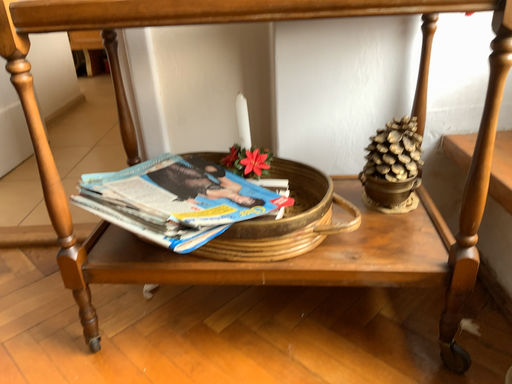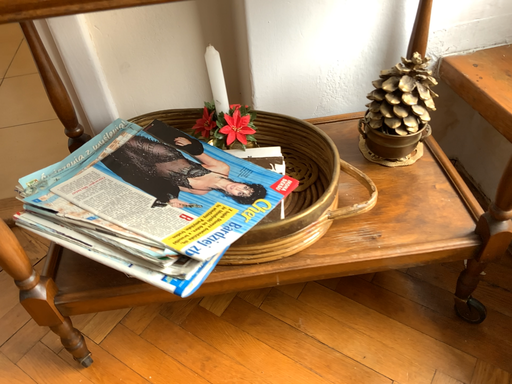
Question: How did the camera likely rotate when shooting the video?

Choices:
 (A) rotated right
 (B) rotated left

Answer: (A)